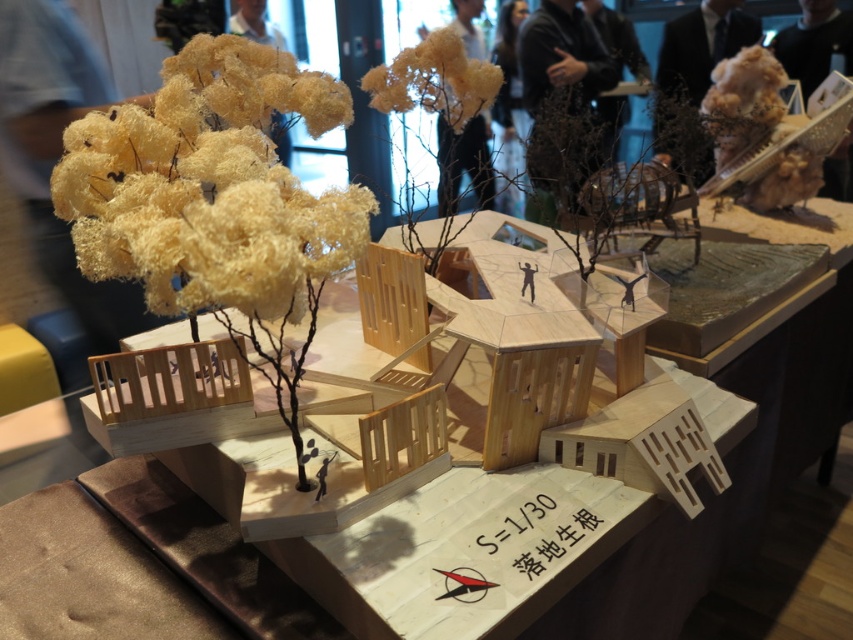
Who is more distant from viewer, (193, 141) or (469, 109)?

Positioned behind is point (469, 109).

Who is shorter, fuzzy yellow flower at upper left or fuzzy yellow flower at upper center?

With less height is fuzzy yellow flower at upper center.

Who is more forward, (286, 273) or (368, 86)?

Point (286, 273)

I want to click on fuzzy yellow flower at upper left, so click(210, 186).

Does natural wood model house at center have a lesser height compared to fuzzy yellow flower at upper center?

In fact, natural wood model house at center may be taller than fuzzy yellow flower at upper center.

Who is positioned more to the right, natural wood model house at center or fuzzy yellow flower at upper center?

natural wood model house at center is more to the right.

Does point (158, 573) lie behind point (413, 106)?

No.

What are the coordinates of `natural wood model house at center` in the screenshot? It's located at (521, 547).

Does natural wood model house at center have a lesser width compared to fuzzy yellow flower at upper left?

No, natural wood model house at center is not thinner than fuzzy yellow flower at upper left.

Between point (457, 515) and point (102, 253), which one is positioned in front?

Point (102, 253)

Describe the element at coordinates (521, 547) in the screenshot. I see `natural wood model house at center` at that location.

Find the location of a particular element. natural wood model house at center is located at coordinates (521, 547).